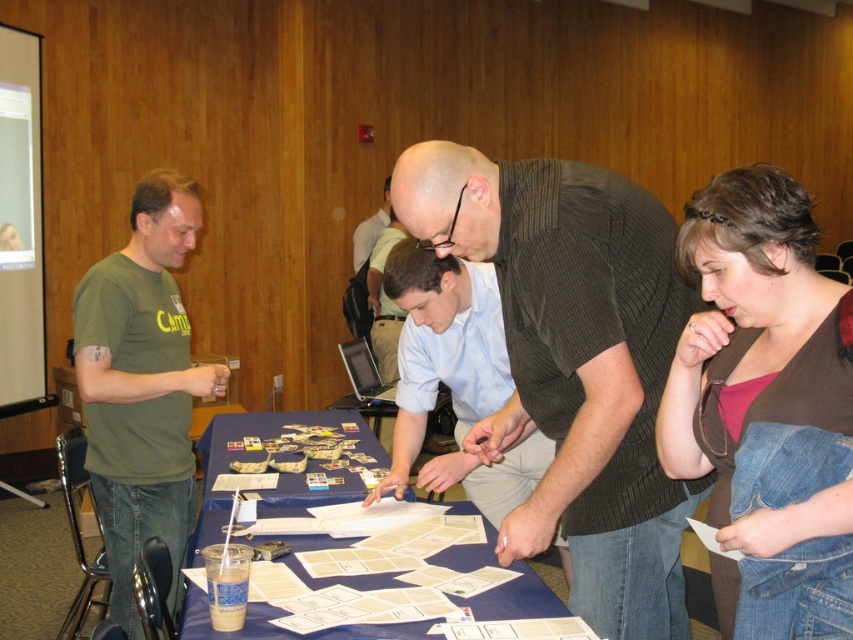
Based on the scene description, where is the dark brown textured shirt at center located in terms of coordinates?

The dark brown textured shirt at center is located at coordinates point (573, 364).